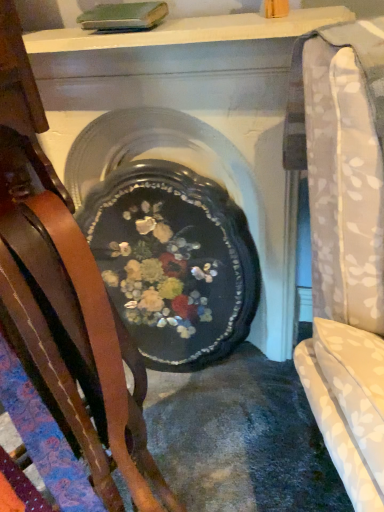
What do you see at coordinates (65, 300) in the screenshot?
I see `wooden chair at left` at bounding box center [65, 300].

Identify the location of wooden chair at left. (65, 300).

The width and height of the screenshot is (384, 512). Describe the element at coordinates (172, 233) in the screenshot. I see `black glossy tray at center` at that location.

The image size is (384, 512). Identify the location of black glossy tray at center. pyautogui.click(x=172, y=233).

Locate an element on the screen. wooden chair at left is located at coordinates (65, 300).

Which is more to the right, wooden chair at left or black glossy tray at center?

black glossy tray at center is more to the right.

Is the depth of wooden chair at left greater than that of black glossy tray at center?

No, wooden chair at left is closer to the viewer.

Between point (23, 161) and point (133, 165), which one is positioned behind?

Positioned behind is point (133, 165).

From the image's perspective, between wooden chair at left and black glossy tray at center, which one is located above?

black glossy tray at center appears higher in the image.

From a real-world perspective, which is physically below, wooden chair at left or black glossy tray at center?

In real-world perspective, black glossy tray at center is lower.

Between wooden chair at left and black glossy tray at center, which one has larger width?

black glossy tray at center.

Who is shorter, wooden chair at left or black glossy tray at center?

With less height is black glossy tray at center.

Considering the relative sizes of wooden chair at left and black glossy tray at center in the image provided, is wooden chair at left smaller than black glossy tray at center?

Yes.

Would you say black glossy tray at center is part of wooden chair at left's contents?

That's incorrect, black glossy tray at center is not inside wooden chair at left.

Are wooden chair at left and black glossy tray at center beside each other?

No, wooden chair at left is not next to black glossy tray at center.

Does wooden chair at left turn towards black glossy tray at center?

No, wooden chair at left does not turn towards black glossy tray at center.

Can you tell me how much wooden chair at left and black glossy tray at center differ in facing direction?

57.2 degrees separate the facing orientations of wooden chair at left and black glossy tray at center.

The width and height of the screenshot is (384, 512). Identify the location of fireplace lying above the wooden chair at left (from the image's perspective). (172, 233).

Which object is positioned more to the left, black glossy tray at center or wooden chair at left?

Positioned to the left is wooden chair at left.

Considering their positions, is black glossy tray at center located in front of or behind wooden chair at left?

Clearly, black glossy tray at center is behind wooden chair at left.

Is point (120, 127) farther from camera compared to point (39, 153)?

Yes, point (120, 127) is behind point (39, 153).

From the image's perspective, is black glossy tray at center over wooden chair at left?

Yes, from the image's perspective, black glossy tray at center is over wooden chair at left.

From a real-world perspective, relative to wooden chair at left, is black glossy tray at center vertically above or below?

From a real-world perspective, black glossy tray at center is physically below wooden chair at left.

Is black glossy tray at center thinner than wooden chair at left?

In fact, black glossy tray at center might be wider than wooden chair at left.

Is black glossy tray at center shorter than wooden chair at left?

Correct, black glossy tray at center is not as tall as wooden chair at left.

Who is bigger, black glossy tray at center or wooden chair at left?

black glossy tray at center.

Do you think black glossy tray at center is within wooden chair at left, or outside of it?

black glossy tray at center exists outside the volume of wooden chair at left.

Is black glossy tray at center far away from wooden chair at left?

No, black glossy tray at center is not far from wooden chair at left.

Is wooden chair at left at the back of black glossy tray at center?

No, black glossy tray at center is not facing away from wooden chair at left.

You are a GUI agent. You are given a task and a screenshot of the screen. Output one action in this format:
    pyautogui.click(x=<x>, y=<y>)
    Task: Click on the fireplace beneath the wooden chair at left (from a real-world perspective)
    
    Given the screenshot: What is the action you would take?
    pos(172,233)

At what (x,y) coordinates should I click in order to perform the action: click on chair below the black glossy tray at center (from the image's perspective). Please return your answer as a coordinate pair (x, y). Looking at the image, I should click on (65, 300).

Image resolution: width=384 pixels, height=512 pixels. Identify the location of fireplace behind the wooden chair at left. (172, 233).